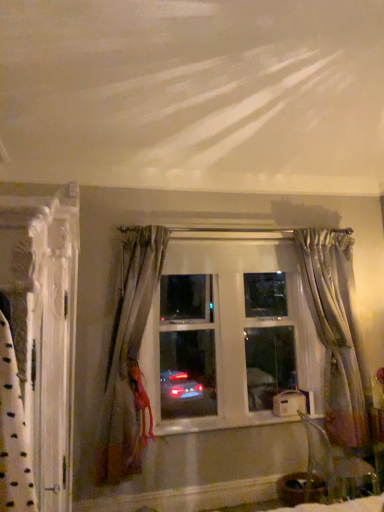
Question: Does white textured curtain at left, which is the first curtain in front-to-back order, have a lesser height compared to clear glass window at center?

Choices:
 (A) yes
 (B) no

Answer: (B)

Question: Is white textured curtain at left, which is the first curtain in front-to-back order, thinner than clear glass window at center?

Choices:
 (A) no
 (B) yes

Answer: (A)

Question: Considering the relative positions of white textured curtain at left, which appears as the 1th curtain when viewed from the left, and clear glass window at center in the image provided, is white textured curtain at left, which appears as the 1th curtain when viewed from the left, behind clear glass window at center?

Choices:
 (A) no
 (B) yes

Answer: (A)

Question: From the image's perspective, is white textured curtain at left, which appears as the 3th curtain when viewed from the right, under clear glass window at center?

Choices:
 (A) no
 (B) yes

Answer: (B)

Question: From the image's perspective, is white textured curtain at left, acting as the third curtain starting from the back, above clear glass window at center?

Choices:
 (A) yes
 (B) no

Answer: (B)

Question: Considering the relative sizes of white textured curtain at left, which appears as the 3th curtain when viewed from the right, and silvery sheer curtain at right, the first curtain when ordered from right to left, in the image provided, is white textured curtain at left, which appears as the 3th curtain when viewed from the right, bigger than silvery sheer curtain at right, the first curtain when ordered from right to left,?

Choices:
 (A) yes
 (B) no

Answer: (A)

Question: From the image's perspective, would you say white textured curtain at left, which appears as the 3th curtain when viewed from the right, is shown under silvery sheer curtain at right, positioned as the 1th curtain in back-to-front order?

Choices:
 (A) no
 (B) yes

Answer: (B)

Question: Does white textured curtain at left, which appears as the 3th curtain when viewed from the right, have a lesser width compared to silvery sheer curtain at right, the first curtain when ordered from right to left?

Choices:
 (A) no
 (B) yes

Answer: (A)

Question: From the image's perspective, is white textured curtain at left, which appears as the 3th curtain when viewed from the right, above silvery sheer curtain at right, positioned as the 1th curtain in back-to-front order?

Choices:
 (A) yes
 (B) no

Answer: (B)

Question: Does white textured curtain at left, which appears as the 1th curtain when viewed from the left, have a greater width compared to silvery sheer curtain at right, placed as the third curtain when sorted from front to back?

Choices:
 (A) yes
 (B) no

Answer: (A)

Question: Is white textured curtain at left, acting as the third curtain starting from the back, taller than silvery sheer curtain at right, which appears as the 3th curtain when viewed from the left?

Choices:
 (A) no
 (B) yes

Answer: (B)

Question: Is satin gray curtain at left, positioned as the 2th curtain in back-to-front order, taller than silvery sheer curtain at right, which appears as the 3th curtain when viewed from the left?

Choices:
 (A) yes
 (B) no

Answer: (B)